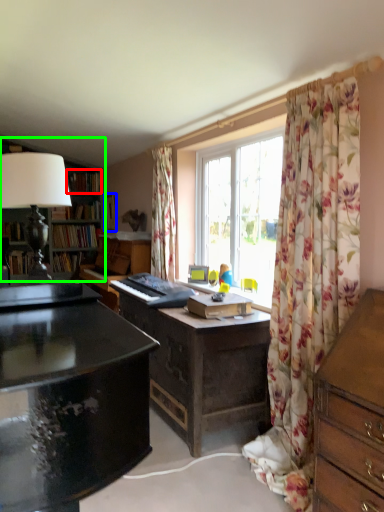
Question: Based on their relative distances, which object is nearer to book (highlighted by a red box)? Choose from picture frame (highlighted by a blue box) and bookcase (highlighted by a green box).

Choices:
 (A) picture frame
 (B) bookcase

Answer: (A)